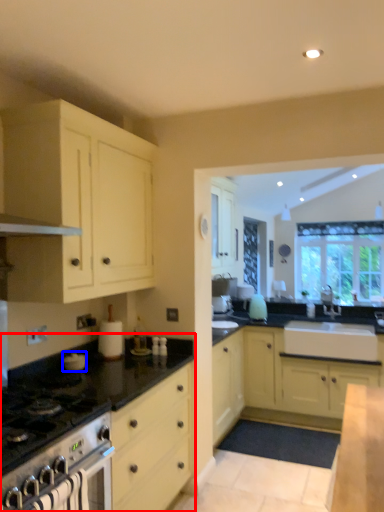
Question: Which point is further to the camera, countertop (highlighted by a red box) or appliance (highlighted by a blue box)?

Choices:
 (A) countertop
 (B) appliance

Answer: (B)